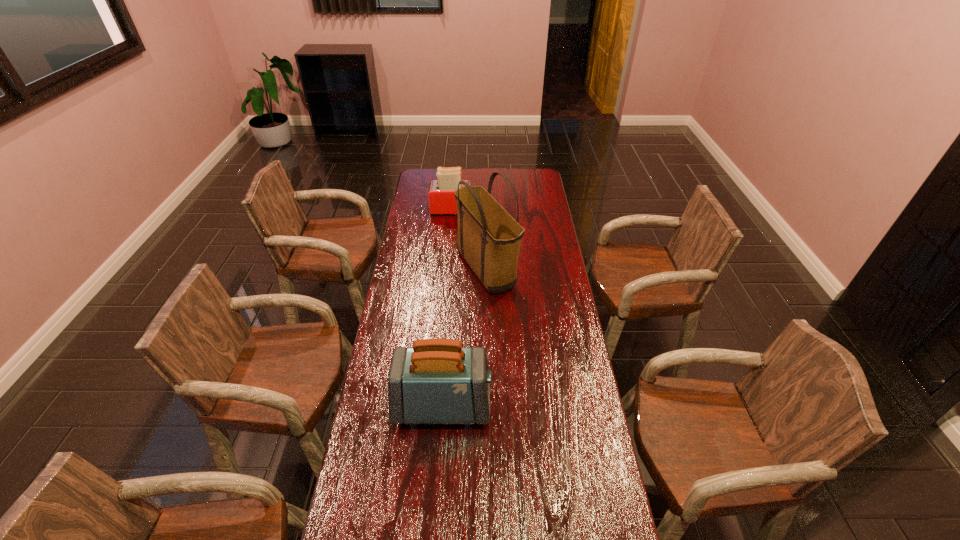
Identify the location of free space at the right edge of the desktop. The height and width of the screenshot is (540, 960). (568, 296).

Where is `vacant area at the far left corner`? The height and width of the screenshot is (540, 960). vacant area at the far left corner is located at coordinates (425, 183).

Identify the location of vacant area at the far right corner. (532, 187).

The width and height of the screenshot is (960, 540). Identify the location of vacant area that lies between the second nearest object and the taller toaster. (465, 338).

I want to click on free space that is in between the farthest object and the second shortest object, so click(447, 308).

The height and width of the screenshot is (540, 960). Identify the location of the second closest object to the shorter toaster. (437, 381).

What are the coordinates of `object identified as the closest to the farthest object` in the screenshot? It's located at (489, 239).

Where is `free location that satisfies the following two spatial constraints: 1. on the front-facing side of the shortest object; 2. on the right side of the tallest object`? This screenshot has height=540, width=960. free location that satisfies the following two spatial constraints: 1. on the front-facing side of the shortest object; 2. on the right side of the tallest object is located at coordinates (448, 271).

Identify the location of free space that satisfies the following two spatial constraints: 1. on the front-facing side of the second nearest object; 2. on the right side of the shorter toaster. (448, 271).

Identify the location of vacant space that satisfies the following two spatial constraints: 1. on the front-facing side of the farthest object; 2. on the right side of the second farthest object. This screenshot has width=960, height=540. (448, 271).